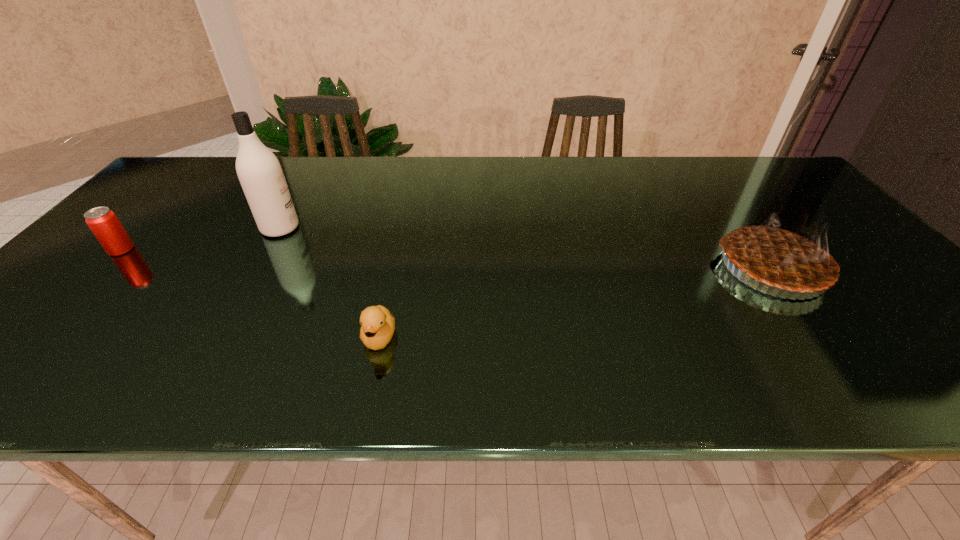
At what (x,y) coordinates should I click in order to perform the action: click on the tallest object. Please return your answer as a coordinate pair (x, y). The image size is (960, 540). Looking at the image, I should click on (259, 171).

Locate an element on the screen. Image resolution: width=960 pixels, height=540 pixels. the second object from left to right is located at coordinates (259, 171).

This screenshot has height=540, width=960. Find the location of `the rightmost object`. the rightmost object is located at coordinates (787, 256).

Image resolution: width=960 pixels, height=540 pixels. Identify the location of pie. (787, 256).

Locate an element on the screen. the second shortest object is located at coordinates (103, 222).

Locate an element on the screen. Image resolution: width=960 pixels, height=540 pixels. can is located at coordinates (103, 222).

Find the location of `duckling`. duckling is located at coordinates (378, 324).

Where is `the shortest object`? The height and width of the screenshot is (540, 960). the shortest object is located at coordinates (378, 324).

Locate an element on the screen. vacant region located 0.160m on the front-facing side of the shampoo is located at coordinates (358, 228).

Find the location of a particular element. vacant space situated 0.320m on the back of the pie is located at coordinates (704, 177).